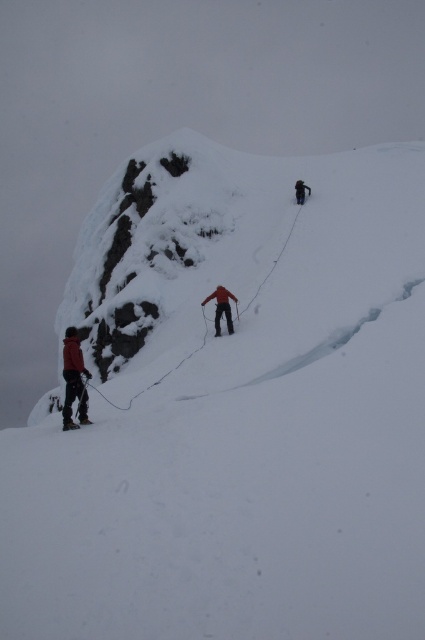
Question: Where is matte red jacket at lower left located in relation to dark gray fabric jacket at upper center in the image?

Choices:
 (A) left
 (B) right

Answer: (A)

Question: Considering the relative positions of matte red jacket at lower left and matte black ski at lower left in the image provided, where is matte red jacket at lower left located with respect to matte black ski at lower left?

Choices:
 (A) below
 (B) above

Answer: (B)

Question: Estimate the real-world distances between objects in this image. Which object is closer to the matte black ski at lower left?

Choices:
 (A) dark gray fabric jacket at upper center
 (B) matte red jacket at lower left
 (C) red fabric jacket at center

Answer: (B)

Question: Which point is farther from the camera taking this photo?

Choices:
 (A) (70, 422)
 (B) (295, 196)

Answer: (B)

Question: Does red fabric jacket at center appear under dark gray fabric jacket at upper center?

Choices:
 (A) no
 (B) yes

Answer: (B)

Question: Considering the real-world distances, which object is closest to the matte red jacket at lower left?

Choices:
 (A) matte black ski at lower left
 (B) dark gray fabric jacket at upper center

Answer: (A)